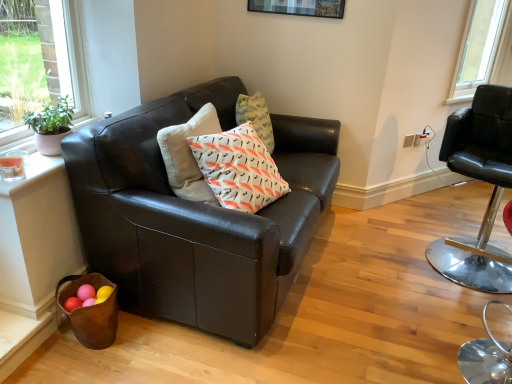
Where is `empty space that is to the right of matte black couch at center`? empty space that is to the right of matte black couch at center is located at coordinates (391, 261).